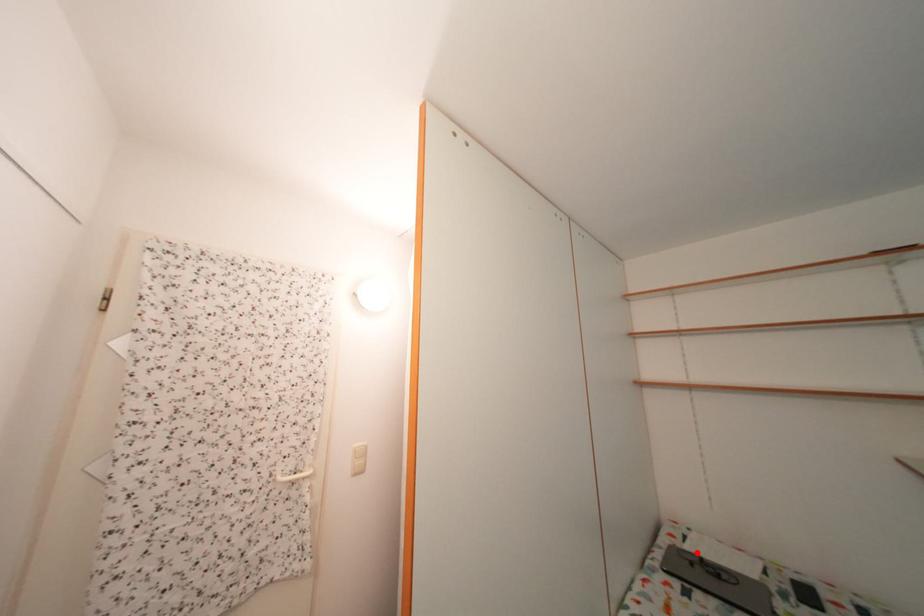
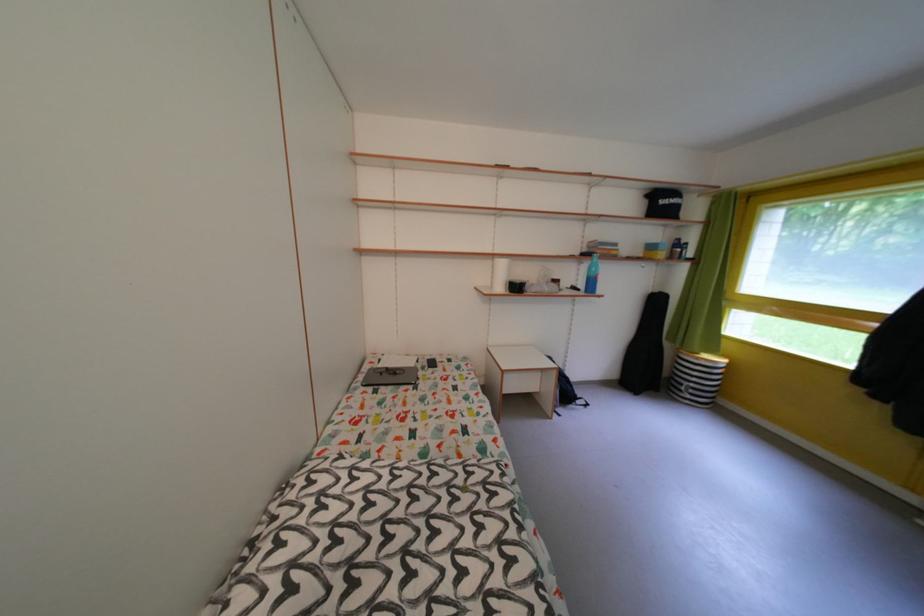
Find the pixel in the second image that matches the highlighted location in the first image.

(391, 371)